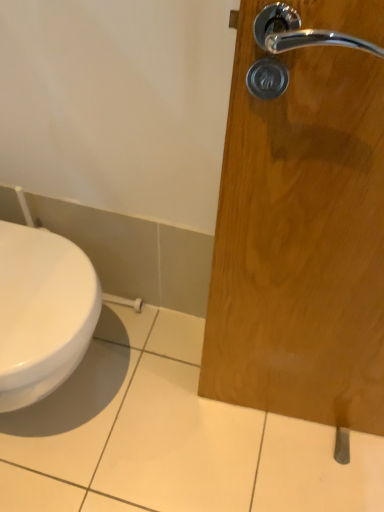
The image size is (384, 512). What do you see at coordinates (342, 445) in the screenshot?
I see `satin nickel door handle at lower right` at bounding box center [342, 445].

What are the coordinates of `satin nickel door handle at lower right` in the screenshot? It's located at (342, 445).

In order to face satin nickel door handle at lower right, should I rotate leftwards or rightwards?

It's best to rotate right around 19.697 degrees.

The width and height of the screenshot is (384, 512). Describe the element at coordinates (42, 312) in the screenshot. I see `white glossy toilet at lower left` at that location.

Where is `white glossy toilet at lower left`? This screenshot has height=512, width=384. white glossy toilet at lower left is located at coordinates (42, 312).

What is the approximate width of white glossy toilet at lower left?

white glossy toilet at lower left is 18.58 inches wide.

Where is `satin nickel door handle at lower right`? satin nickel door handle at lower right is located at coordinates (342, 445).

Is white glossy toilet at lower left at the right side of satin nickel door handle at lower right?

No, white glossy toilet at lower left is not to the right of satin nickel door handle at lower right.

Is white glossy toilet at lower left further to the viewer compared to satin nickel door handle at lower right?

That is False.

Considering the positions of points (22, 279) and (345, 440), is point (22, 279) closer to camera compared to point (345, 440)?

Yes, it is.

From the image's perspective, is white glossy toilet at lower left located above or below satin nickel door handle at lower right?

From the image's perspective, white glossy toilet at lower left appears above satin nickel door handle at lower right.

From a real-world perspective, which object rests below the other?

From a 3D spatial view, satin nickel door handle at lower right is below.

Considering the sizes of objects white glossy toilet at lower left and satin nickel door handle at lower right in the image provided, who is wider, white glossy toilet at lower left or satin nickel door handle at lower right?

Wider between the two is white glossy toilet at lower left.

From their relative heights in the image, would you say white glossy toilet at lower left is taller or shorter than satin nickel door handle at lower right?

Clearly, white glossy toilet at lower left is taller compared to satin nickel door handle at lower right.

Which of these two, white glossy toilet at lower left or satin nickel door handle at lower right, is bigger?

white glossy toilet at lower left is bigger.

Do you think white glossy toilet at lower left is within satin nickel door handle at lower right, or outside of it?

white glossy toilet at lower left cannot be found inside satin nickel door handle at lower right.

Looking at this image, can you see white glossy toilet at lower left touching satin nickel door handle at lower right?

No, white glossy toilet at lower left is not with satin nickel door handle at lower right.

Is white glossy toilet at lower left looking in the opposite direction of satin nickel door handle at lower right?

No.

Can you tell me how much white glossy toilet at lower left and satin nickel door handle at lower right differ in facing direction?

There is a 0.446-degree angle between the facing directions of white glossy toilet at lower left and satin nickel door handle at lower right.

I want to click on door handle on the right of white glossy toilet at lower left, so click(x=342, y=445).

Based on their positions, is satin nickel door handle at lower right located to the left or right of white glossy toilet at lower left?

satin nickel door handle at lower right is to the right of white glossy toilet at lower left.

Is satin nickel door handle at lower right in front of white glossy toilet at lower left?

No.

Between point (346, 434) and point (52, 301), which one is positioned in front?

The point (52, 301) is closer to the camera.

From the image's perspective, which one is positioned lower, satin nickel door handle at lower right or white glossy toilet at lower left?

satin nickel door handle at lower right, from the image's perspective.

From a real-world perspective, is satin nickel door handle at lower right over white glossy toilet at lower left?

No.

Can you confirm if satin nickel door handle at lower right is wider than white glossy toilet at lower left?

No, satin nickel door handle at lower right is not wider than white glossy toilet at lower left.

Who is taller, satin nickel door handle at lower right or white glossy toilet at lower left?

Standing taller between the two is white glossy toilet at lower left.

Considering the relative sizes of satin nickel door handle at lower right and white glossy toilet at lower left in the image provided, is satin nickel door handle at lower right bigger than white glossy toilet at lower left?

Actually, satin nickel door handle at lower right might be smaller than white glossy toilet at lower left.

Is satin nickel door handle at lower right inside the boundaries of white glossy toilet at lower left, or outside?

satin nickel door handle at lower right is located beyond the bounds of white glossy toilet at lower left.

Is the surface of satin nickel door handle at lower right in direct contact with white glossy toilet at lower left?

No, satin nickel door handle at lower right is not in contact with white glossy toilet at lower left.

Is satin nickel door handle at lower right aimed at white glossy toilet at lower left?

No, satin nickel door handle at lower right is not facing towards white glossy toilet at lower left.

Consider the image. How many degrees apart are the facing directions of satin nickel door handle at lower right and white glossy toilet at lower left?

There is a 0.446-degree angle between the facing directions of satin nickel door handle at lower right and white glossy toilet at lower left.

At what (x,y) coordinates should I click in order to perform the action: click on door handle to the right of white glossy toilet at lower left. Please return your answer as a coordinate pair (x, y). Looking at the image, I should click on (342, 445).

The width and height of the screenshot is (384, 512). In order to click on door handle beneath the white glossy toilet at lower left (from a real-world perspective) in this screenshot , I will do `click(342, 445)`.

This screenshot has width=384, height=512. In order to click on toilet that appears above the satin nickel door handle at lower right (from a real-world perspective) in this screenshot , I will do coord(42,312).